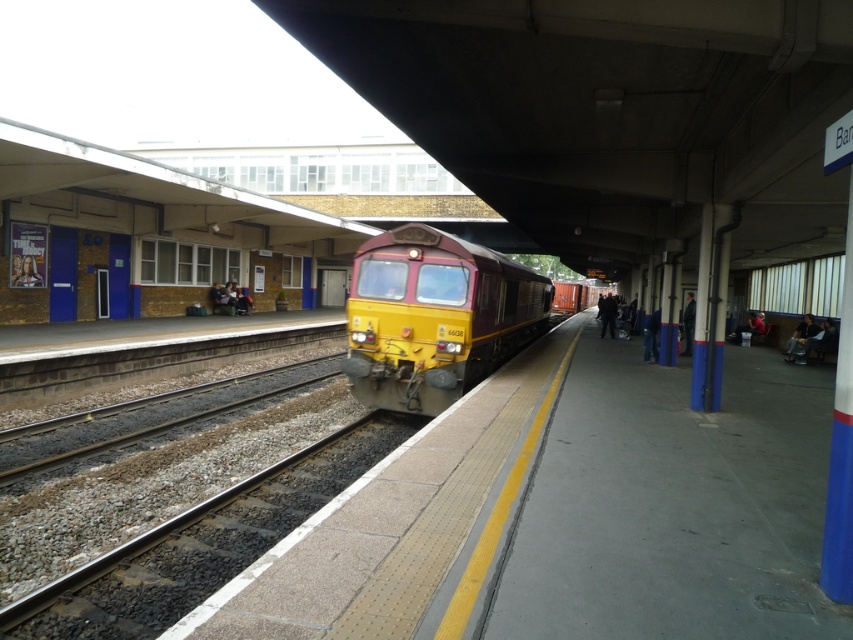
Question: Can you confirm if gravel railway track at center is positioned below yellow polished metal train at center?

Choices:
 (A) no
 (B) yes

Answer: (B)

Question: Estimate the real-world distances between objects in this image. Which object is closer to the gravel railway track at center?

Choices:
 (A) brown gravel track at center
 (B) yellow polished metal train at center

Answer: (A)

Question: Which of the following is the closest to the observer?

Choices:
 (A) brown gravel track at center
 (B) yellow polished metal train at center
 (C) gravel railway track at center

Answer: (C)

Question: Can you confirm if gravel railway track at center is positioned to the right of yellow polished metal train at center?

Choices:
 (A) yes
 (B) no

Answer: (B)

Question: Estimate the real-world distances between objects in this image. Which object is farther from the brown gravel track at center?

Choices:
 (A) gravel railway track at center
 (B) yellow polished metal train at center

Answer: (B)

Question: Can you confirm if yellow polished metal train at center is positioned above brown gravel track at center?

Choices:
 (A) yes
 (B) no

Answer: (A)